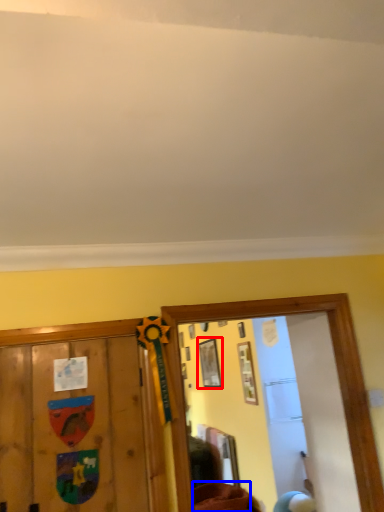
Question: Which object is closer to the camera taking this photo, picture frame (highlighted by a red box) or furniture (highlighted by a blue box)?

Choices:
 (A) picture frame
 (B) furniture

Answer: (B)